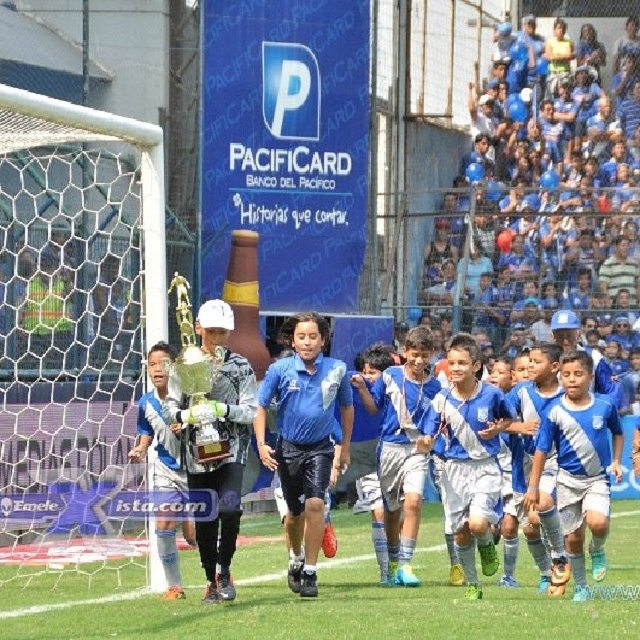
Question: Can you confirm if green grass at center is positioned to the left of blue jersey at center?

Choices:
 (A) no
 (B) yes

Answer: (B)

Question: Which object appears farthest from the camera in this image?

Choices:
 (A) shiny silver trophy at center
 (B) blue matte soccer uniform at center
 (C) blue shiny shorts at center
 (D) white matte soccer uniform at center

Answer: (C)

Question: From the image, what is the correct spatial relationship of shiny silver trophy at center in relation to blue matte soccer uniform at center?

Choices:
 (A) right
 (B) left

Answer: (B)

Question: Among these objects, which one is nearest to the camera?

Choices:
 (A) white mesh net at left
 (B) blue jersey at center

Answer: (A)

Question: Which of the following is the closest to the observer?

Choices:
 (A) (36, 163)
 (B) (416, 332)

Answer: (B)

Question: Is shiny silver trophy at center thinner than blue shiny shorts at center?

Choices:
 (A) no
 (B) yes

Answer: (A)